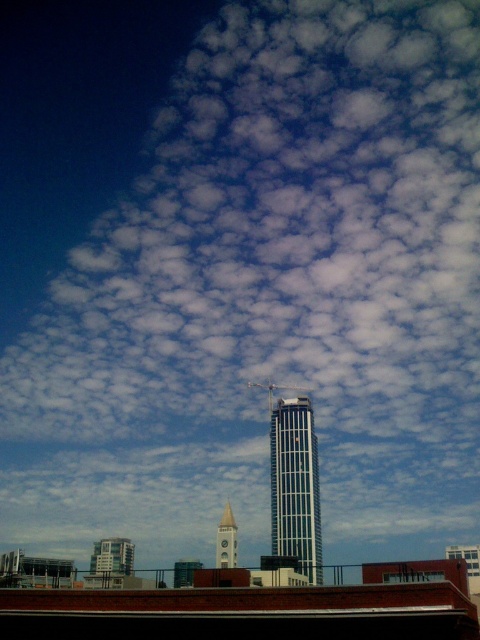
You are an architect designing a new building. You observe the silver metallic bell tower at center and the light gray stone bell tower at center in the urban skyline. Which of these two bell towers is bigger in size?

The silver metallic bell tower at center is larger in size compared to the light gray stone bell tower at center.